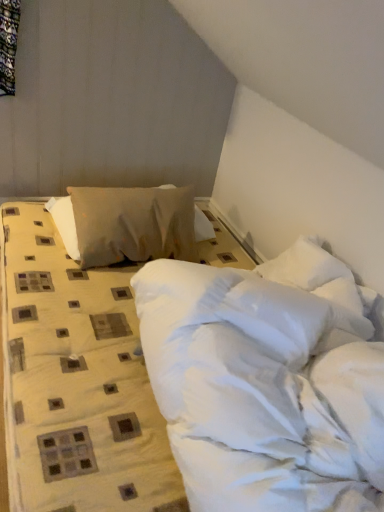
What do you see at coordinates (126, 224) in the screenshot? I see `textured beige pillow at center` at bounding box center [126, 224].

Where is `textured beige pillow at center`? textured beige pillow at center is located at coordinates pyautogui.click(x=126, y=224).

Where is `textured beige pillow at center`? textured beige pillow at center is located at coordinates (126, 224).